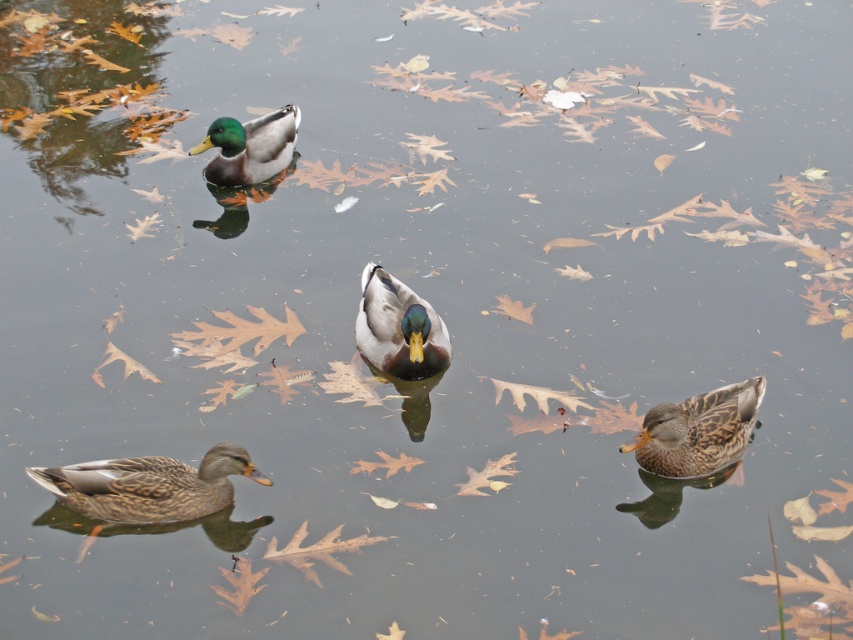
Which of these two, brown speckled duck at lower right or green glossy duck at upper center, stands taller?

With more height is green glossy duck at upper center.

Is brown speckled duck at lower right further to the viewer compared to green glossy duck at upper center?

No, it is in front of green glossy duck at upper center.

The height and width of the screenshot is (640, 853). Find the location of `brown speckled duck at lower right`. brown speckled duck at lower right is located at coordinates (697, 429).

Is shiny green duck at center further to camera compared to green glossy duck at upper center?

No, shiny green duck at center is in front of green glossy duck at upper center.

Does shiny green duck at center have a smaller size compared to green glossy duck at upper center?

Correct, shiny green duck at center occupies less space than green glossy duck at upper center.

Between point (444, 346) and point (282, 170), which one is positioned behind?

Positioned behind is point (282, 170).

The image size is (853, 640). Identify the location of shiny green duck at center. (398, 326).

Can you confirm if brown matte duck at lower left is positioned to the left of brown speckled duck at lower right?

Yes, brown matte duck at lower left is to the left of brown speckled duck at lower right.

This screenshot has height=640, width=853. Describe the element at coordinates (149, 484) in the screenshot. I see `brown matte duck at lower left` at that location.

The image size is (853, 640). I want to click on brown matte duck at lower left, so coord(149,484).

At what (x,y) coordinates should I click in order to perform the action: click on brown matte duck at lower left. Please return your answer as a coordinate pair (x, y). This screenshot has width=853, height=640. Looking at the image, I should click on (149, 484).